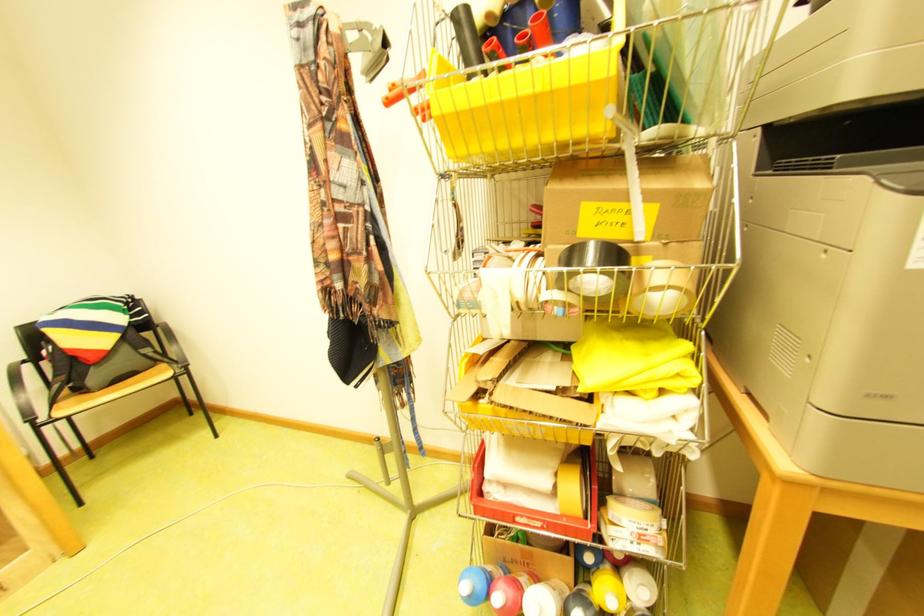
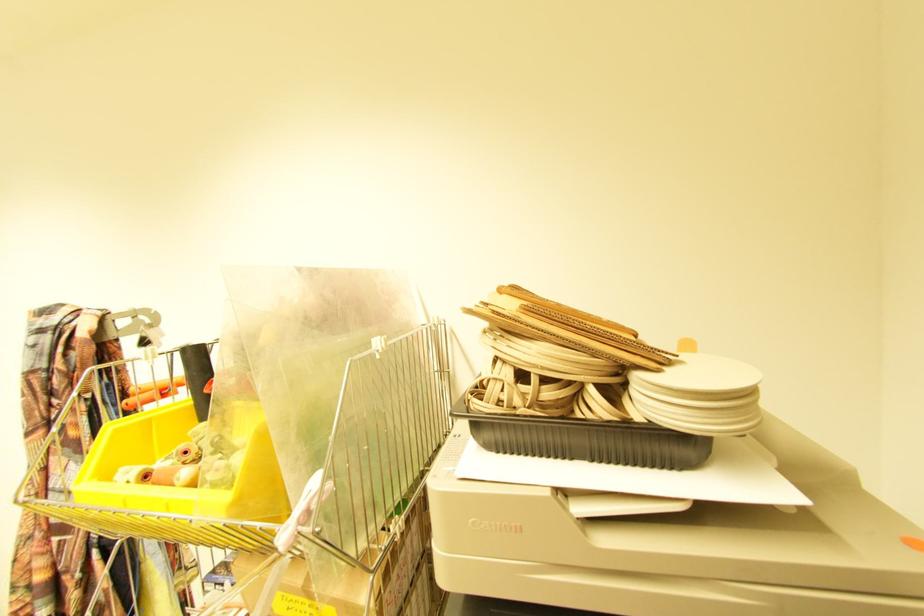
Question: How did the camera likely rotate?

Choices:
 (A) Left
 (B) Right
 (C) Up
 (D) Down

Answer: (C)